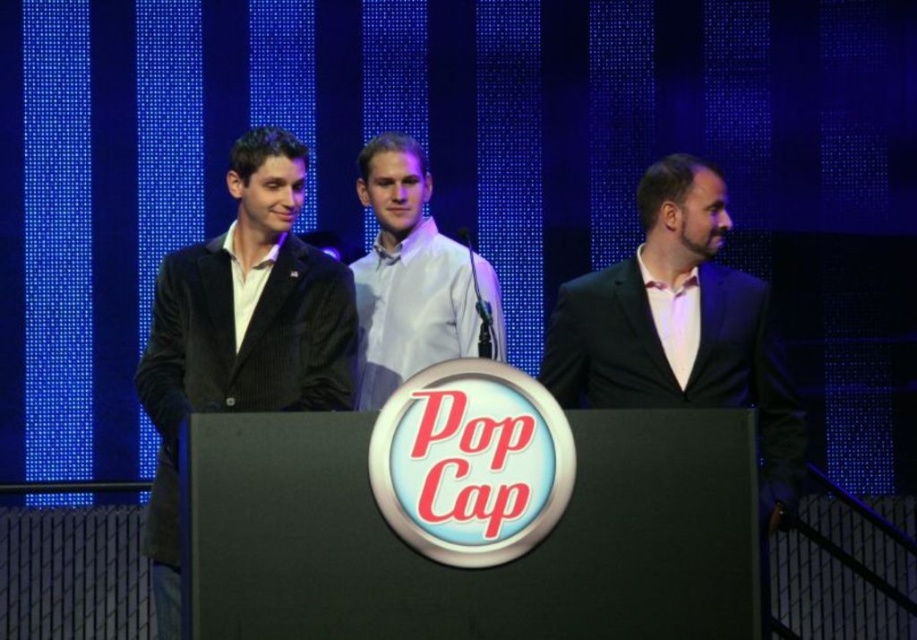
You are an event organizer who needs to arrange a microphone stand between the matte black suit at right and the white glossy shirt at center. The stand requires at least 3 feet of space to be placed. Can you fit it between them?

The matte black suit at right and white glossy shirt at center are 4.12 feet apart from each other, which is more than the required 3 feet. Therefore, the microphone stand can be placed between them.

You are an event photographer positioned at the front of the stage. You need to capture a photo that includes both the matte black suit at right and the white glossy shirt at center. Based on their positions, which one should you adjust your camera focus to first to ensure both are in frame?

The matte black suit at right is to the right of the white glossy shirt at center. To ensure both are in frame, focus on the white glossy shirt at center first, then adjust the camera to include the matte black suit at right.